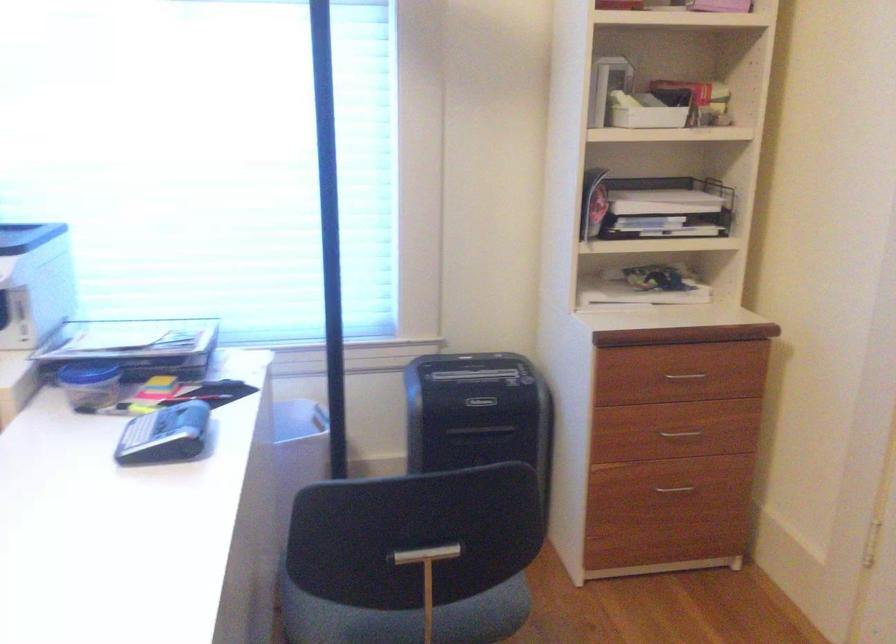
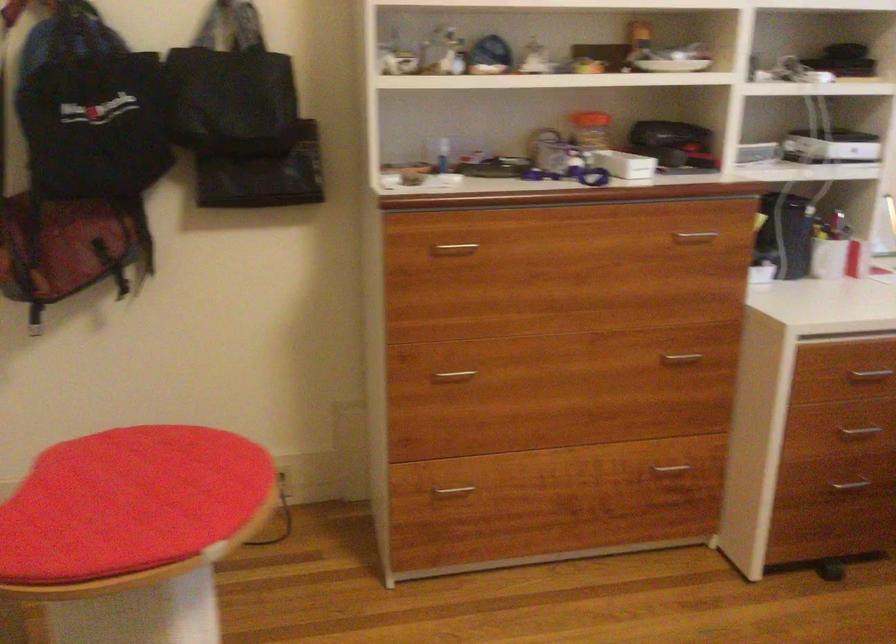
Question: Based on the continuous images, in which direction is the camera rotating? Reply with the corresponding letter.

Choices:
 (A) Left
 (B) Right
 (C) Up
 (D) Down

Answer: (A)